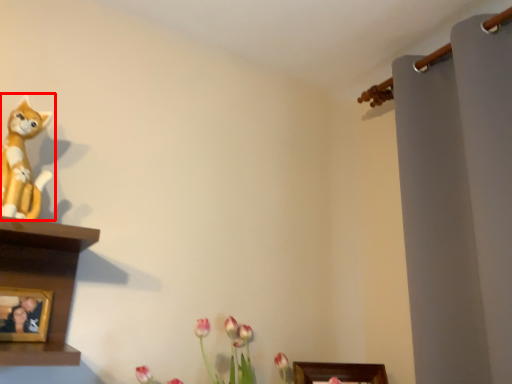
Question: From the image's perspective, where is toy (annotated by the red box) located relative to picture frame?

Choices:
 (A) above
 (B) below

Answer: (A)